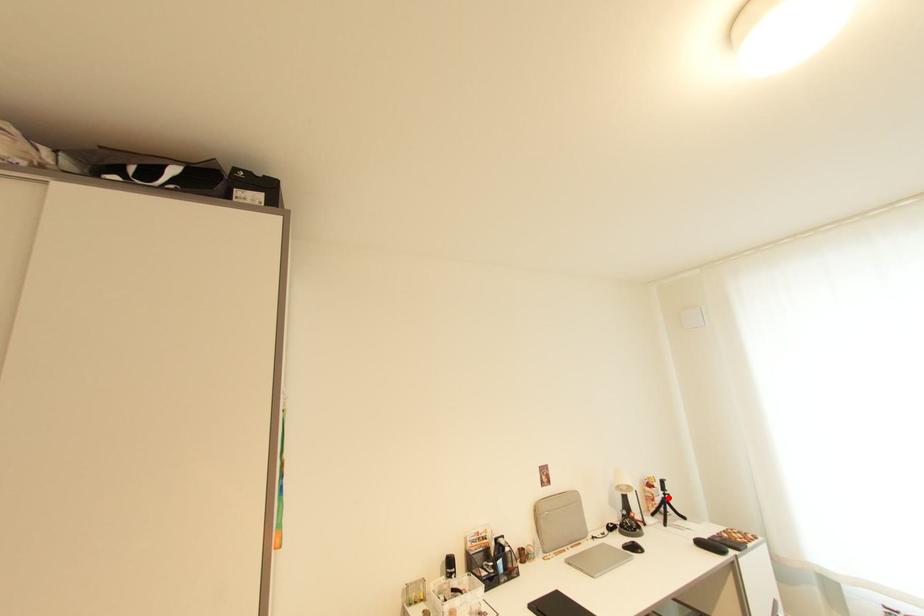
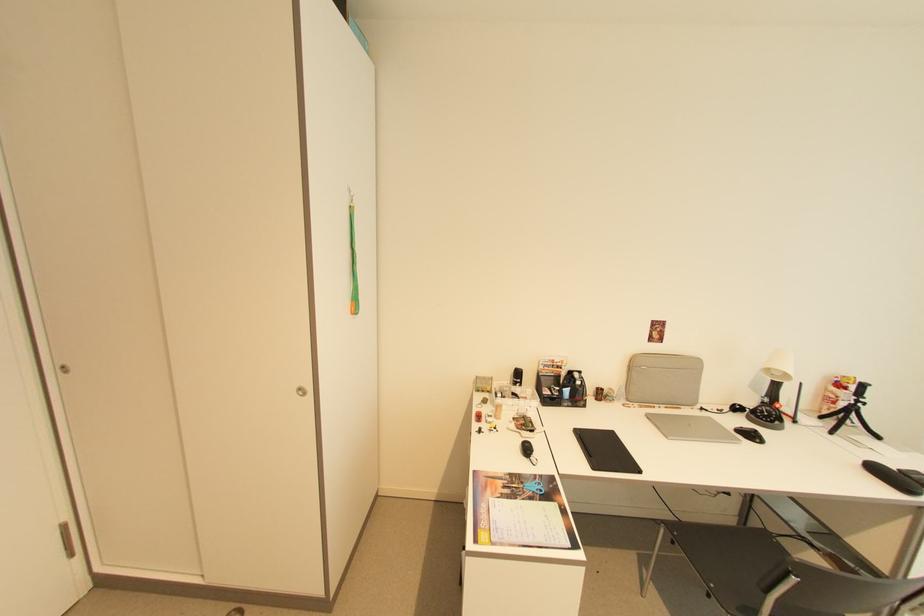
Question: I am providing you with two images of the same scene from different viewpoints. In image1, a red point is highlighted. Considering the same 3D point in image2, which of the following is correct?

Choices:
 (A) It is closer
 (B) It is farther

Answer: (A)